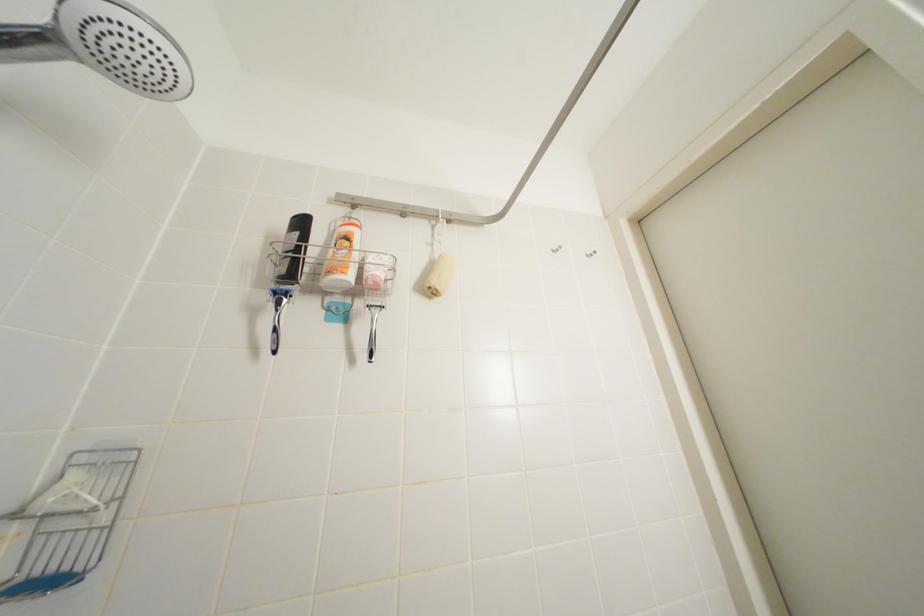
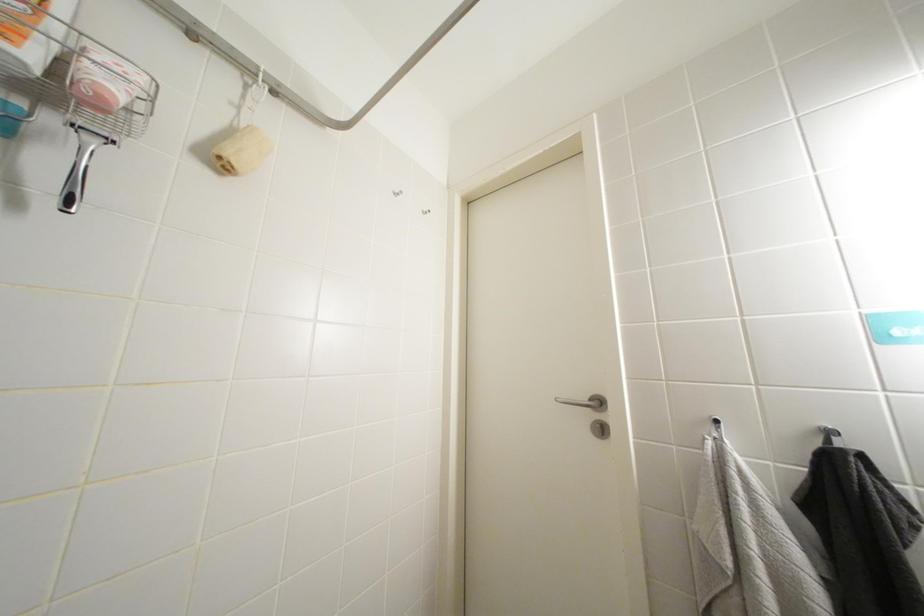
Question: The camera is either moving clockwise (left) or counter-clockwise (right) around the object. The first image is from the beginning of the video and the second image is from the end. Is the camera moving left or right when shooting the video?

Choices:
 (A) Left
 (B) Right

Answer: (A)